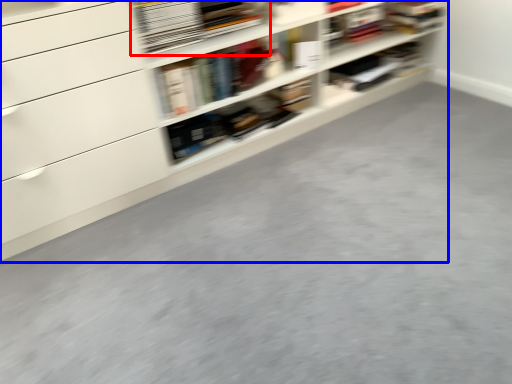
Question: Which object appears closest to the camera in this image, book (highlighted by a red box) or shelf (highlighted by a blue box)?

Choices:
 (A) book
 (B) shelf

Answer: (B)